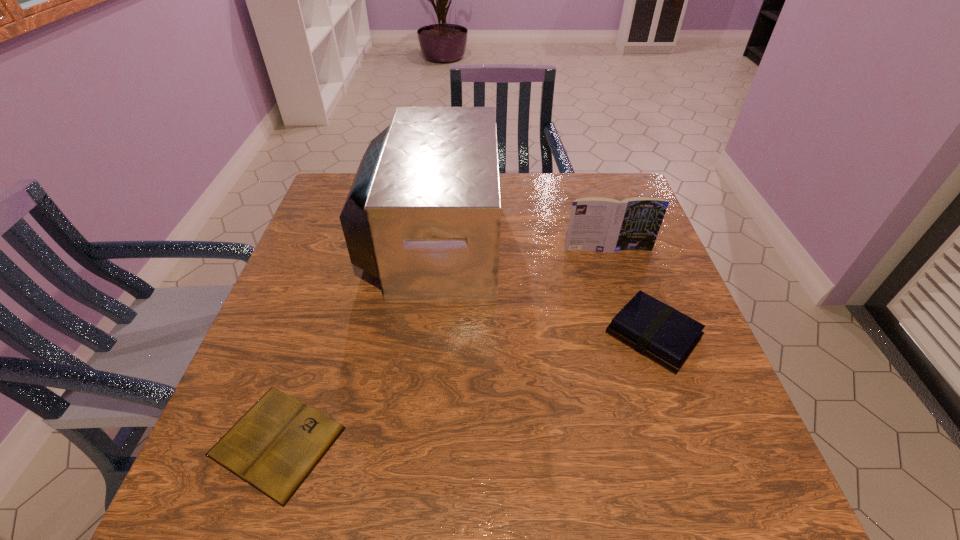
Find the location of a particular element. The width and height of the screenshot is (960, 540). free space between the leftmost book and the tallest object is located at coordinates (355, 340).

Identify which object is the second nearest to the second shortest object. Please provide its 2D coordinates. Your answer should be formatted as a tuple, i.e. [(x, y)], where the tuple contains the x and y coordinates of a point satisfying the conditions above.

[(423, 215)]

Locate which object is the closest to the shortest object. Please provide its 2D coordinates. Your answer should be formatted as a tuple, i.e. [(x, y)], where the tuple contains the x and y coordinates of a point satisfying the conditions above.

[(423, 215)]

Select which book is the closest to the tallest book. Please provide its 2D coordinates. Your answer should be formatted as a tuple, i.e. [(x, y)], where the tuple contains the x and y coordinates of a point satisfying the conditions above.

[(656, 330)]

The height and width of the screenshot is (540, 960). I want to click on book identified as the second closest to the third shortest object, so click(x=274, y=447).

I want to click on vacant area that satisfies the following two spatial constraints: 1. on the front cover of the third tallest object; 2. on the right side of the farthest book, so click(636, 336).

The image size is (960, 540). I want to click on vacant region that satisfies the following two spatial constraints: 1. on the front-facing side of the second shortest book; 2. on the right side of the tallest object, so click(420, 336).

Locate an element on the screen. vacant region that satisfies the following two spatial constraints: 1. on the front-facing side of the second nearest book; 2. on the left side of the microwave oven is located at coordinates (420, 336).

Locate an element on the screen. The height and width of the screenshot is (540, 960). free space that satisfies the following two spatial constraints: 1. on the front-facing side of the tallest object; 2. on the right side of the second shortest object is located at coordinates (420, 336).

Locate an element on the screen. The image size is (960, 540). blank area in the image that satisfies the following two spatial constraints: 1. on the front-facing side of the second tallest book; 2. on the left side of the tallest object is located at coordinates (420, 336).